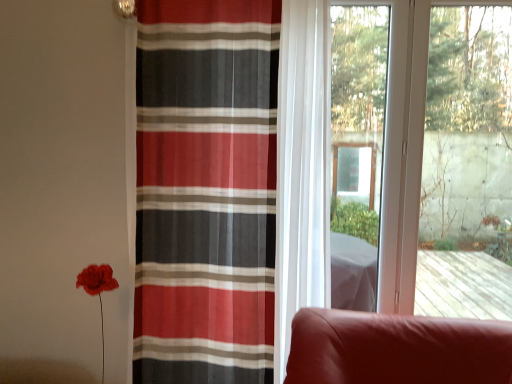
Question: From a real-world perspective, is transparent glass window at center positioned above or below striped sheer curtain at center?

Choices:
 (A) below
 (B) above

Answer: (B)

Question: Is point (400, 81) closer or farther from the camera than point (272, 334)?

Choices:
 (A) farther
 (B) closer

Answer: (A)

Question: Is transparent glass window at center situated inside striped sheer curtain at center or outside?

Choices:
 (A) inside
 (B) outside

Answer: (B)

Question: In the image, is striped sheer curtain at center positioned in front of or behind transparent glass window at center?

Choices:
 (A) front
 (B) behind

Answer: (A)

Question: From their relative heights in the image, would you say striped sheer curtain at center is taller or shorter than transparent glass window at center?

Choices:
 (A) short
 (B) tall

Answer: (B)

Question: From the image's perspective, is striped sheer curtain at center positioned above or below transparent glass window at center?

Choices:
 (A) above
 (B) below

Answer: (B)

Question: Is striped sheer curtain at center bigger or smaller than transparent glass window at center?

Choices:
 (A) small
 (B) big

Answer: (B)